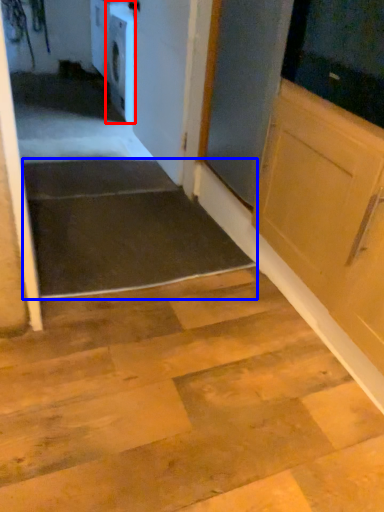
Question: Which point is closer to the camera, dish washer (highlighted by a red box) or stairwell (highlighted by a blue box)?

Choices:
 (A) dish washer
 (B) stairwell

Answer: (B)